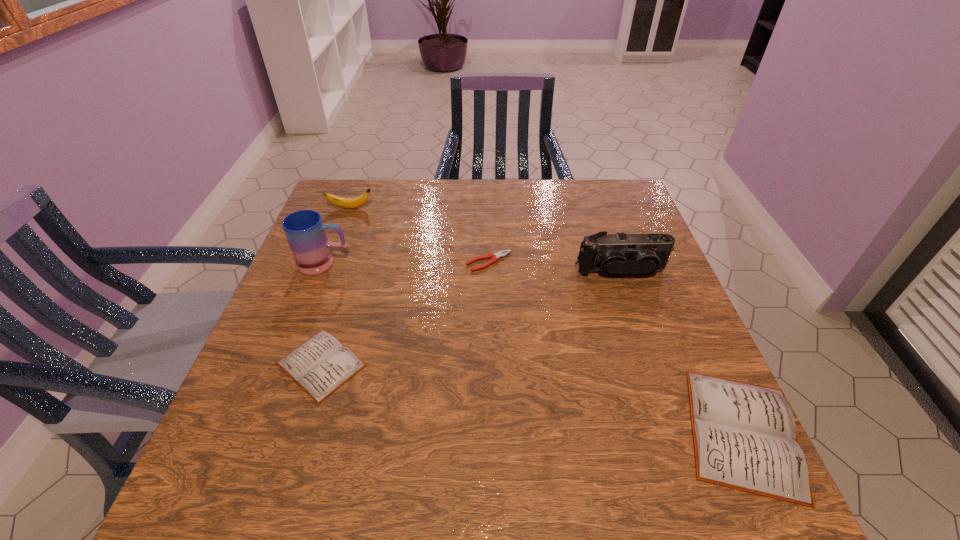
If the aim is uniform spacing by inserting an additional diary among them, please point to a vacant space for this new diary. Please provide its 2D coordinates. Your answer should be formatted as a tuple, i.e. [(x, y)], where the tuple contains the x and y coordinates of a point satisfying the conditions above.

[(518, 396)]